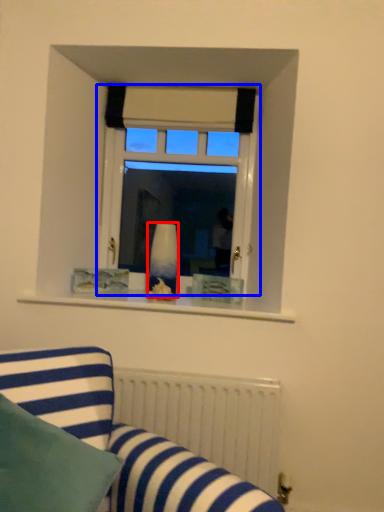
Question: Which object appears farthest to the camera in this image, vase (highlighted by a red box) or window (highlighted by a blue box)?

Choices:
 (A) vase
 (B) window

Answer: (B)